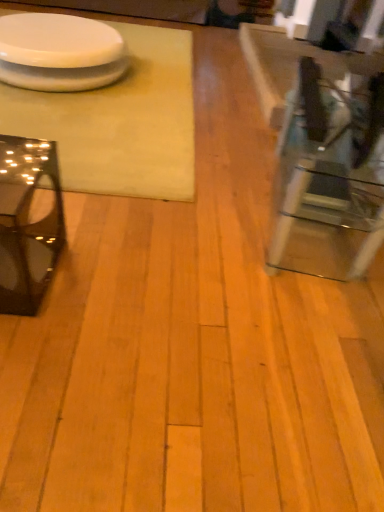
Find the location of `free point to the left of clear glass table at right, which is the third table from left to right`. free point to the left of clear glass table at right, which is the third table from left to right is located at coordinates (189, 205).